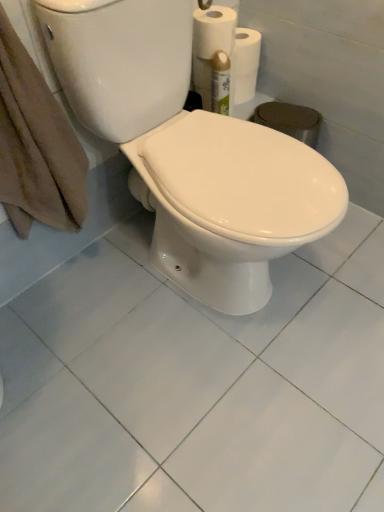
Question: Looking at the image, does brown cotton towel at left seem bigger or smaller compared to white glossy toilet at center?

Choices:
 (A) small
 (B) big

Answer: (A)

Question: From a real-world perspective, is brown cotton towel at left physically located above or below white glossy toilet at center?

Choices:
 (A) above
 (B) below

Answer: (A)

Question: Which object is positioned closest to the brown cotton towel at left?

Choices:
 (A) white glossy ceramic tile at center
 (B) white glossy toilet at center

Answer: (B)

Question: Which object is the farthest from the white glossy ceramic tile at center?

Choices:
 (A) brown cotton towel at left
 (B) white glossy toilet at center

Answer: (A)